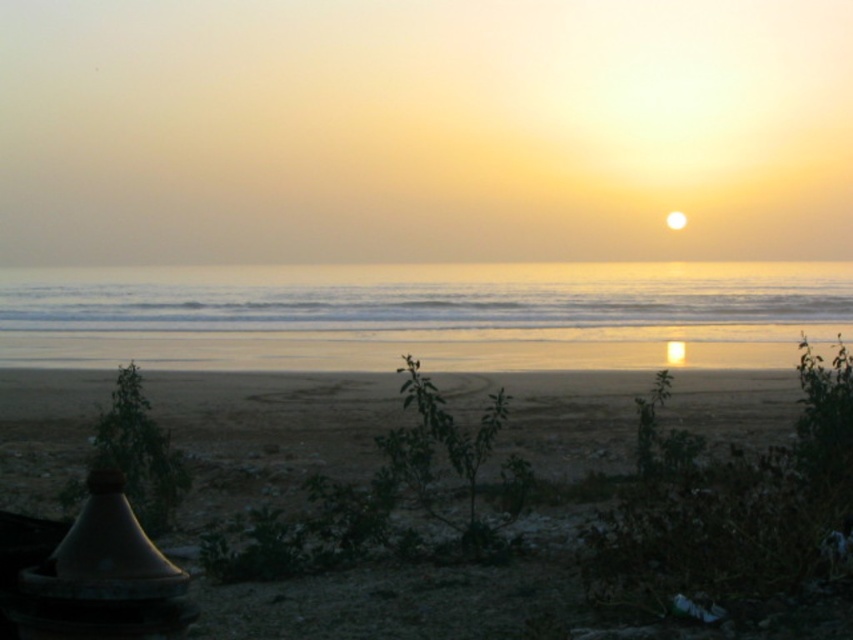
You are standing on the beach looking at the two points marked in the image. Which point, point (747, 557) or point (508, 269), is closer to you?

Point (747, 557) is closer to the camera than point (508, 269).

You are standing on the sandy beach at lower center and want to reach the silvery reflective water at center. Which direction should you move to get there?

You should move upwards because the sandy beach at lower center is located below the silvery reflective water at center.